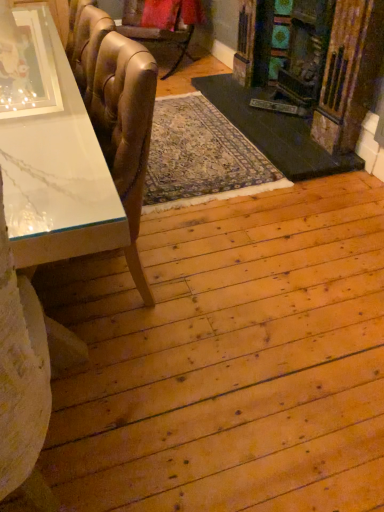
Where is `wooden fireplace at right`? wooden fireplace at right is located at coordinates (318, 95).

Locate an element on the screen. leather-like gold chair at upper left, acting as the second chair starting from the front is located at coordinates (161, 22).

Find the location of a particular element. white marble table at left is located at coordinates (58, 180).

The height and width of the screenshot is (512, 384). I want to click on leather at left, the second chair in the back-to-front sequence, so click(119, 118).

Which object is thinner, wooden fireplace at right or leather at left, positioned as the 1th chair in front-to-back order?

Thinner between the two is wooden fireplace at right.

Is wooden fireplace at right at the right side of leather at left, the second chair in the back-to-front sequence?

Correct, you'll find wooden fireplace at right to the right of leather at left, the second chair in the back-to-front sequence.

Is the depth of wooden fireplace at right greater than that of leather at left, the first chair ordered from the bottom?

Yes, the depth of wooden fireplace at right is greater than that of leather at left, the first chair ordered from the bottom.

From the image's perspective, which is below, wooden fireplace at right or leather at left, positioned as the second chair in top-to-bottom order?

From the image's view, leather at left, positioned as the second chair in top-to-bottom order, is below.

Is leather at left, the second chair in the back-to-front sequence, surrounding white marble table at left?

Definitely not — white marble table at left is not inside leather at left, the second chair in the back-to-front sequence.

From a real-world perspective, who is located higher, leather at left, the first chair ordered from the bottom, or white marble table at left?

From a 3D spatial view, leather at left, the first chair ordered from the bottom, is above.

Is leather at left, the first chair ordered from the bottom, not near white marble table at left?

No, leather at left, the first chair ordered from the bottom, is not far away from white marble table at left.

Considering the points (105, 112) and (60, 135), which point is in front, point (105, 112) or point (60, 135)?

Point (60, 135)

Is white marble table at left behind leather at left, the first chair ordered from the bottom?

That is False.

How different are the orientations of white marble table at left and leather at left, the second chair in the back-to-front sequence, in degrees?

90.6 degrees.

From a real-world perspective, is white marble table at left positioned under leather at left, the second chair in the back-to-front sequence, based on gravity?

Correct, in the physical world, white marble table at left is lower than leather at left, the second chair in the back-to-front sequence.

From the image's perspective, is white marble table at left above or below leather at left, positioned as the 1th chair in front-to-back order?

From the image's perspective, white marble table at left appears above leather at left, positioned as the 1th chair in front-to-back order.

In terms of size, does wooden fireplace at right appear bigger or smaller than white marble table at left?

wooden fireplace at right is smaller than white marble table at left.

Is wooden fireplace at right positioned behind white marble table at left?

Yes, wooden fireplace at right is further from the camera.

From the image's perspective, who appears lower, wooden fireplace at right or white marble table at left?

From the image's view, white marble table at left is below.

Locate an element on the screen. The width and height of the screenshot is (384, 512). table on the left of wooden fireplace at right is located at coordinates (58, 180).

Is white marble table at left further to the viewer compared to wooden fireplace at right?

No, the depth of white marble table at left is less than that of wooden fireplace at right.

Are white marble table at left and wooden fireplace at right beside each other?

They are not placed beside each other.

Would you say white marble table at left is to the left or to the right of wooden fireplace at right in the picture?

white marble table at left is to the left of wooden fireplace at right.

Is leather at left, the first chair ordered from the bottom, at the back of leather-like gold chair at upper left, which ranks as the second chair in bottom-to-top order?

No, leather-like gold chair at upper left, which ranks as the second chair in bottom-to-top order,'s orientation is not away from leather at left, the first chair ordered from the bottom.

How different are the orientations of leather-like gold chair at upper left, which ranks as the second chair in bottom-to-top order, and leather at left, positioned as the 1th chair in front-to-back order, in degrees?

45.6 degrees.

Which is in front, point (195, 0) or point (132, 129)?

Point (132, 129)

From the image's perspective, who appears lower, leather-like gold chair at upper left, positioned as the first chair in back-to-front order, or leather at left, positioned as the second chair in top-to-bottom order?

leather at left, positioned as the second chair in top-to-bottom order, from the image's perspective.

From a real-world perspective, is white marble table at left physically located above or below leather-like gold chair at upper left, positioned as the first chair in back-to-front order?

In terms of real-world spatial position, white marble table at left is above leather-like gold chair at upper left, positioned as the first chair in back-to-front order.

Is white marble table at left far from leather-like gold chair at upper left, positioned as the first chair in back-to-front order?

Yes.

Is white marble table at left to the left or to the right of leather-like gold chair at upper left, which ranks as the second chair in bottom-to-top order, in the image?

white marble table at left is to the left of leather-like gold chair at upper left, which ranks as the second chair in bottom-to-top order.

Based on their sizes in the image, would you say white marble table at left is bigger or smaller than leather-like gold chair at upper left, which ranks as the second chair in bottom-to-top order?

In the image, white marble table at left appears to be larger than leather-like gold chair at upper left, which ranks as the second chair in bottom-to-top order.

Identify the location of chair in front of the wooden fireplace at right. [119, 118].

Find the location of `table located on the left of leather at left, positioned as the 1th chair in front-to-back order`. table located on the left of leather at left, positioned as the 1th chair in front-to-back order is located at coordinates (58, 180).

When comparing their distances from leather-like gold chair at upper left, which ranks as the second chair in bottom-to-top order, does wooden fireplace at right or white marble table at left seem further?

white marble table at left is positioned further to the anchor leather-like gold chair at upper left, which ranks as the second chair in bottom-to-top order.

Estimate the real-world distances between objects in this image. Which object is further from leather-like gold chair at upper left, acting as the second chair starting from the front, white marble table at left or wooden fireplace at right?

The object further to leather-like gold chair at upper left, acting as the second chair starting from the front, is white marble table at left.

Considering their positions, is leather at left, positioned as the 1th chair in front-to-back order, positioned further to wooden fireplace at right than white marble table at left?

white marble table at left lies further to wooden fireplace at right than the other object.

Looking at the image, which one is located further to leather at left, positioned as the second chair in top-to-bottom order, white marble table at left or leather-like gold chair at upper left, positioned as the first chair in back-to-front order?

The object further to leather at left, positioned as the second chair in top-to-bottom order, is leather-like gold chair at upper left, positioned as the first chair in back-to-front order.

Consider the image. Looking at the image, which one is located further to leather-like gold chair at upper left, acting as the second chair starting from the front, leather at left, positioned as the second chair in top-to-bottom order, or white marble table at left?

The object further to leather-like gold chair at upper left, acting as the second chair starting from the front, is white marble table at left.

Considering their positions, is leather-like gold chair at upper left, marked as the first chair in a top-to-bottom arrangement, positioned closer to white marble table at left than wooden fireplace at right?

wooden fireplace at right is positioned closer to the anchor white marble table at left.

Consider the image. Looking at the image, which one is located closer to leather at left, the first chair ordered from the bottom, wooden fireplace at right or white marble table at left?

white marble table at left is closer to leather at left, the first chair ordered from the bottom.

Considering their positions, is leather at left, the second chair in the back-to-front sequence, positioned closer to wooden fireplace at right than leather-like gold chair at upper left, which ranks as the second chair in bottom-to-top order?

leather-like gold chair at upper left, which ranks as the second chair in bottom-to-top order, lies closer to wooden fireplace at right than the other object.

You are a GUI agent. You are given a task and a screenshot of the screen. Output one action in this format:
    pyautogui.click(x=<x>, y=<y>)
    Task: Click on the chair positioned between white marble table at left and leather-like gold chair at upper left, positioned as the first chair in back-to-front order, from near to far
    
    Given the screenshot: What is the action you would take?
    pyautogui.click(x=119, y=118)

Identify the location of fireplace between white marble table at left and leather-like gold chair at upper left, acting as the second chair starting from the front, from front to back. This screenshot has width=384, height=512. (318, 95).

Locate an element on the screen. The height and width of the screenshot is (512, 384). fireplace between leather at left, the second chair in the back-to-front sequence, and leather-like gold chair at upper left, marked as the first chair in a top-to-bottom arrangement, from front to back is located at coordinates (318, 95).